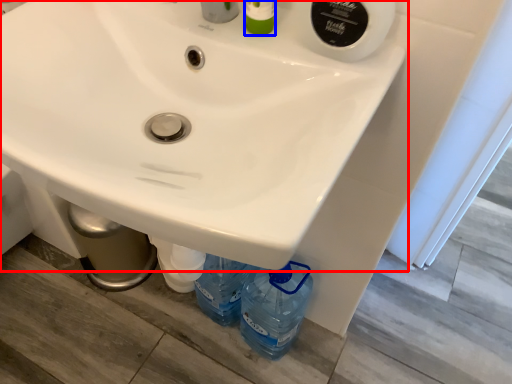
Question: Which object appears farthest to the camera in this image, sink (highlighted by a red box) or toiletry (highlighted by a blue box)?

Choices:
 (A) sink
 (B) toiletry

Answer: (B)